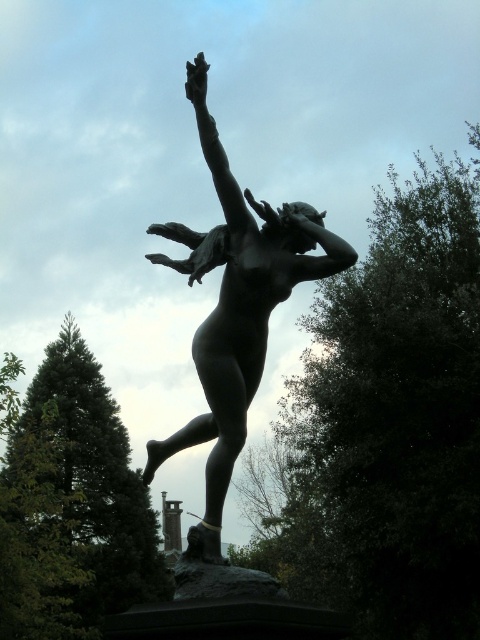
You are standing in front of the bronze statue of a nude female figure in mid movement. There are two points marked on the statue, one at point coordinates point (230, 225) and the other at point coordinates point (323, 248). Which point is closer to you?

Point (230, 225) is closer to you because it is further to the viewer than point (323, 248).

What are the coordinates of the bronze statue at center?

The bronze statue at center is located at coordinates point (236, 308).